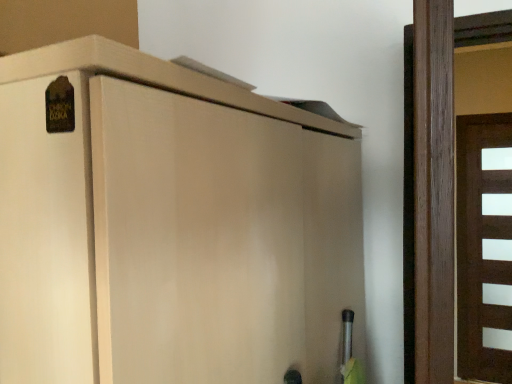
Question: Does brown matte door at right, the 2th door when ordered from front to back, have a lesser width compared to brown wooden door at right, which is counted as the 2th door, starting from the right?

Choices:
 (A) yes
 (B) no

Answer: (A)

Question: Is brown matte door at right, the 2th door when ordered from front to back, taller than brown wooden door at right, acting as the 1th door starting from the left?

Choices:
 (A) yes
 (B) no

Answer: (A)

Question: Is brown matte door at right, the second door viewed from the left, looking in the opposite direction of brown wooden door at right, arranged as the 1th door when viewed from the front?

Choices:
 (A) yes
 (B) no

Answer: (B)

Question: Is brown matte door at right, the 1th door positioned from the back, at the right side of brown wooden door at right, acting as the 1th door starting from the left?

Choices:
 (A) yes
 (B) no

Answer: (A)

Question: Does brown matte door at right, the 2th door when ordered from front to back, have a larger size compared to brown wooden door at right, the second door when ordered from back to front?

Choices:
 (A) no
 (B) yes

Answer: (B)

Question: From the image's perspective, is brown matte door at right, placed as the 1th door when sorted from right to left, located above brown wooden door at right, acting as the 1th door starting from the left?

Choices:
 (A) yes
 (B) no

Answer: (B)

Question: Is brown wooden door at right, which is counted as the 2th door, starting from the right, oriented towards brown matte door at right, the 1th door positioned from the back?

Choices:
 (A) no
 (B) yes

Answer: (A)

Question: Is brown wooden door at right, acting as the 1th door starting from the left, at the left side of brown matte door at right, the second door viewed from the left?

Choices:
 (A) yes
 (B) no

Answer: (A)

Question: From a real-world perspective, is brown wooden door at right, which is counted as the 2th door, starting from the right, on brown matte door at right, the 2th door when ordered from front to back?

Choices:
 (A) yes
 (B) no

Answer: (A)

Question: Is brown wooden door at right, which is counted as the 2th door, starting from the right, looking in the opposite direction of brown matte door at right, the 2th door when ordered from front to back?

Choices:
 (A) yes
 (B) no

Answer: (B)

Question: From a real-world perspective, is brown wooden door at right, acting as the 1th door starting from the left, under brown matte door at right, the 2th door when ordered from front to back?

Choices:
 (A) no
 (B) yes

Answer: (A)

Question: Considering the relative sizes of matte wood cupboard at upper left and brown matte door at right, the second door viewed from the left, in the image provided, is matte wood cupboard at upper left taller than brown matte door at right, the second door viewed from the left,?

Choices:
 (A) yes
 (B) no

Answer: (B)